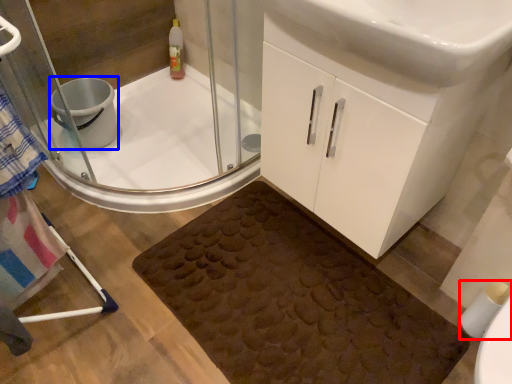
Question: Which object is closer to the camera taking this photo, toilet paper (highlighted by a red box) or toilet bowl (highlighted by a blue box)?

Choices:
 (A) toilet paper
 (B) toilet bowl

Answer: (A)